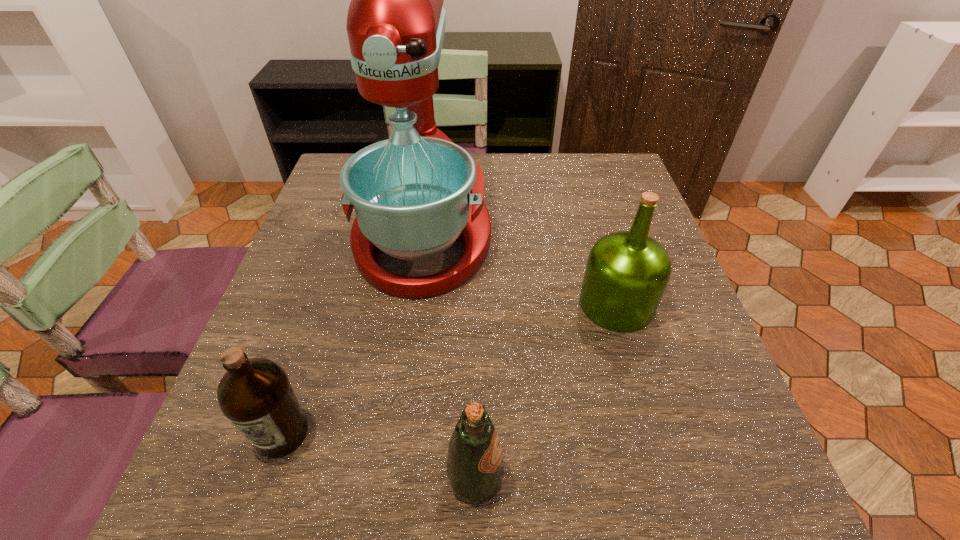
Point out which object is positioned as the second nearest to the second olive oil from left to right. Please provide its 2D coordinates. Your answer should be formatted as a tuple, i.e. [(x, y)], where the tuple contains the x and y coordinates of a point satisfying the conditions above.

[(627, 272)]

Choose which object is the second nearest neighbor to the second olive oil from left to right. Please provide its 2D coordinates. Your answer should be formatted as a tuple, i.e. [(x, y)], where the tuple contains the x and y coordinates of a point satisfying the conditions above.

[(627, 272)]

You are a GUI agent. You are given a task and a screenshot of the screen. Output one action in this format:
    pyautogui.click(x=<x>, y=<y>)
    Task: Click on the olive oil that can be found as the closest to the mixer
    
    Given the screenshot: What is the action you would take?
    pyautogui.click(x=627, y=272)

You are a GUI agent. You are given a task and a screenshot of the screen. Output one action in this format:
    pyautogui.click(x=<x>, y=<y>)
    Task: Click on the olive oil that is the second nearest to the rightmost object
    
    Given the screenshot: What is the action you would take?
    pyautogui.click(x=255, y=394)

Where is `vacant space that satisfies the following two spatial constraints: 1. on the front-facing side of the mixer; 2. on the left side of the rightmost object`? The width and height of the screenshot is (960, 540). vacant space that satisfies the following two spatial constraints: 1. on the front-facing side of the mixer; 2. on the left side of the rightmost object is located at coordinates (414, 304).

Image resolution: width=960 pixels, height=540 pixels. I want to click on free location that satisfies the following two spatial constraints: 1. on the front-facing side of the mixer; 2. on the left side of the rightmost olive oil, so click(414, 304).

Identify the location of vacant area in the image that satisfies the following two spatial constraints: 1. on the front-facing side of the mixer; 2. on the left side of the tallest olive oil. (414, 304).

Locate an element on the screen. The image size is (960, 540). vacant space that satisfies the following two spatial constraints: 1. on the front-facing side of the tallest object; 2. on the left side of the farthest olive oil is located at coordinates (414, 304).